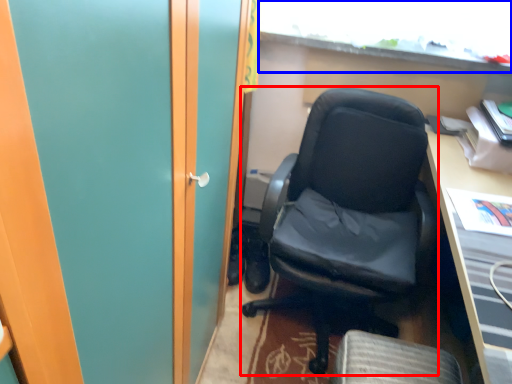
Question: Which object is further to the camera taking this photo, chair (highlighted by a red box) or window (highlighted by a blue box)?

Choices:
 (A) chair
 (B) window

Answer: (B)